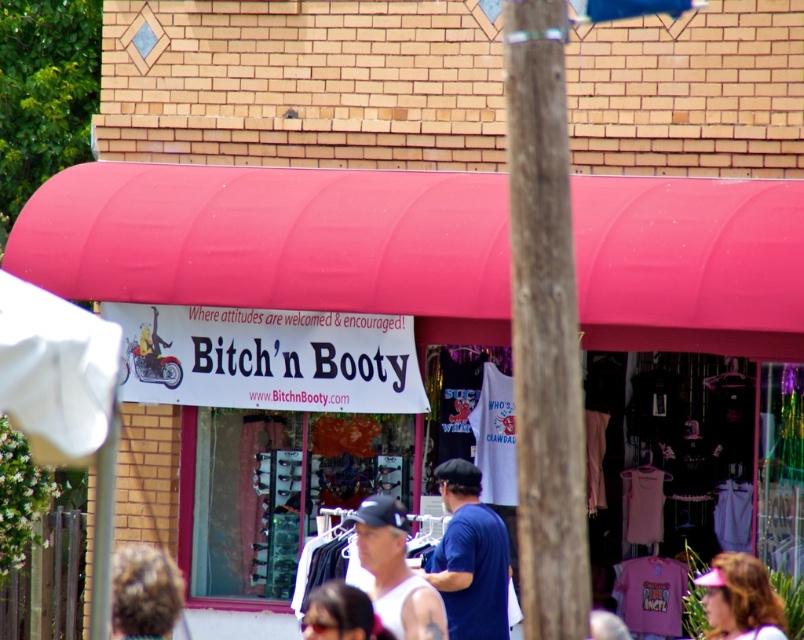
You are a customer looking at the store window display. You see a blue cotton shirt at center and a white tank top at center. Which clothing item is closer to you, the customer?

The blue cotton shirt at center is closer to you because it is positioned under the white tank top at center, meaning it is in front.

You are a customer looking through the storefront window. You notice two items displayed inside the store. Which item is taller between the white tank top at center and the pink fabric visor at lower right?

The white tank top at center is taller than the pink fabric visor at lower right.

You are a customer looking through the storefront window. You see a white tank top at center and a pink fabric visor at lower right. Which item is closer to you through the window?

The white tank top at center is closer to you because it is in front of the pink fabric visor at lower right.